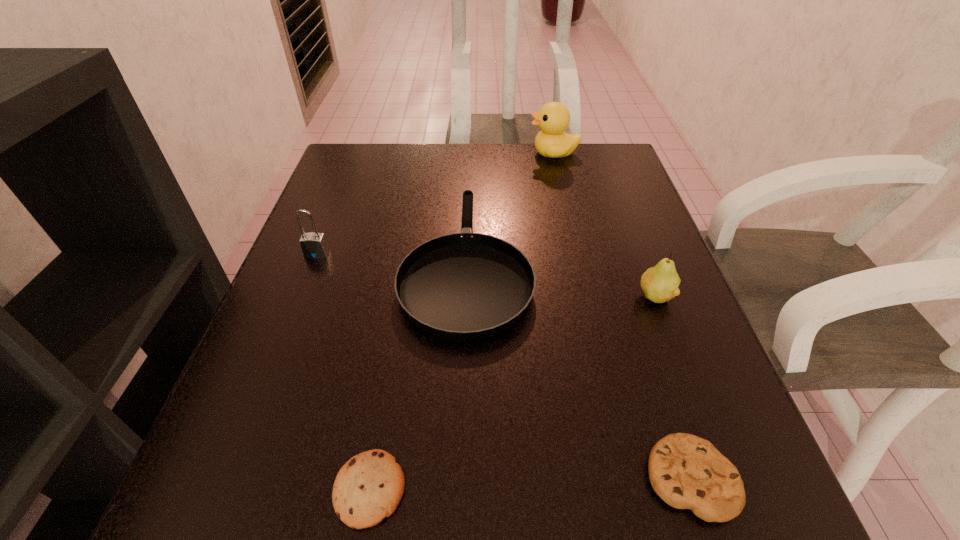
Where is `duck`? duck is located at coordinates coord(553,118).

Locate an element on the screen. The height and width of the screenshot is (540, 960). the farthest object is located at coordinates (553, 118).

Where is `padlock`? padlock is located at coordinates (313, 245).

The height and width of the screenshot is (540, 960). Find the location of `pear`. pear is located at coordinates (660, 283).

The width and height of the screenshot is (960, 540). Find the location of `the third shortest object`. the third shortest object is located at coordinates (463, 286).

Locate an element on the screen. The width and height of the screenshot is (960, 540). the second shortest object is located at coordinates (686, 471).

Locate an element on the screen. the right cookie is located at coordinates (686, 471).

Locate an element on the screen. the shortest object is located at coordinates tap(368, 488).

I want to click on the left cookie, so click(368, 488).

In order to click on vacant area situated 0.250m on the face of the farthest object in this screenshot , I will do `click(435, 153)`.